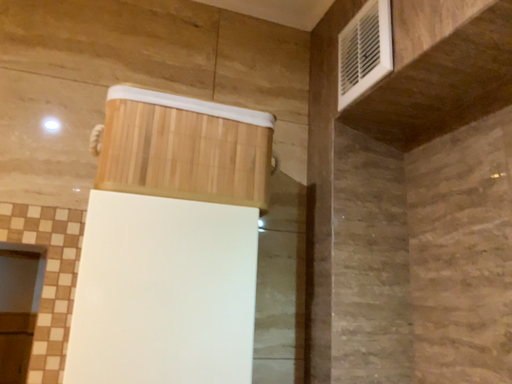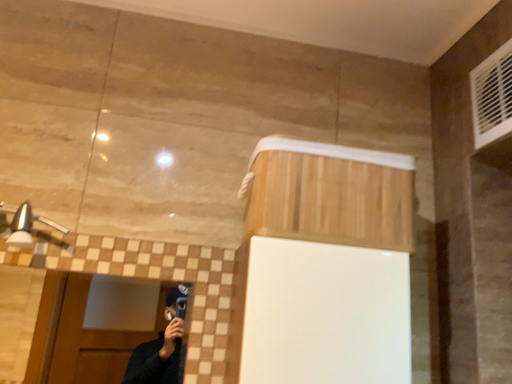
Question: Which way did the camera rotate in the video?

Choices:
 (A) rotated right
 (B) rotated left

Answer: (B)